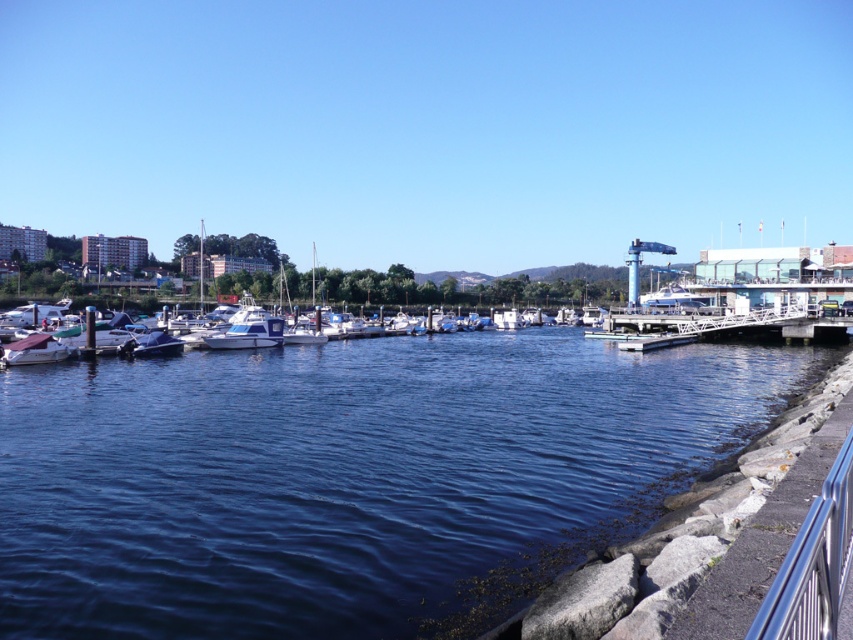
Question: Can you confirm if satin silver railing at lower right is smaller than matte white boat at lower left?

Choices:
 (A) no
 (B) yes

Answer: (B)

Question: Does satin silver railing at lower right have a larger size compared to matte white boat at lower left?

Choices:
 (A) no
 (B) yes

Answer: (A)

Question: Which object is the farthest from the white glossy boat at center?

Choices:
 (A) blue water at center
 (B) satin silver railing at lower right

Answer: (B)

Question: Which point is closer to the camera?

Choices:
 (A) satin silver railing at lower right
 (B) blue water at center
 (C) matte white boat at lower left
 (D) white glossy boat at center

Answer: (A)

Question: Which of the following is the farthest from the observer?

Choices:
 (A) (91, 451)
 (B) (782, 600)

Answer: (A)

Question: Does white glossy boat at center have a greater width compared to matte white boat at lower left?

Choices:
 (A) yes
 (B) no

Answer: (A)